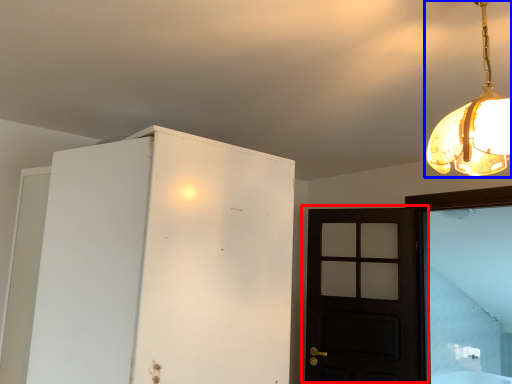
Question: Which point is further to the camera, door (highlighted by a red box) or lamp (highlighted by a blue box)?

Choices:
 (A) door
 (B) lamp

Answer: (A)